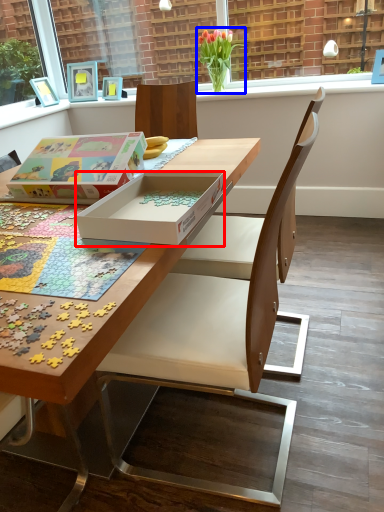
Question: Which object appears closest to the camera in this image, box (highlighted by a red box) or flower (highlighted by a blue box)?

Choices:
 (A) box
 (B) flower

Answer: (A)